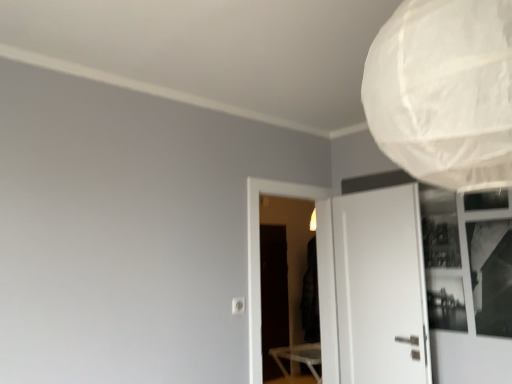
Question: From the image's perspective, would you say black matte screen door at center, the 2th screen door when ordered from front to back, is positioned over white paper lampshade at upper right?

Choices:
 (A) no
 (B) yes

Answer: (A)

Question: Can you confirm if black matte screen door at center, the first screen door positioned from the back, is taller than white paper lampshade at upper right?

Choices:
 (A) yes
 (B) no

Answer: (A)

Question: Does black matte screen door at center, the 2th screen door when ordered from front to back, lie behind white paper lampshade at upper right?

Choices:
 (A) yes
 (B) no

Answer: (A)

Question: Would you say black matte screen door at center, the 2th screen door when ordered from front to back, contains white paper lampshade at upper right?

Choices:
 (A) no
 (B) yes

Answer: (A)

Question: Is black matte screen door at center, the first screen door positioned from the back, in contact with white paper lampshade at upper right?

Choices:
 (A) no
 (B) yes

Answer: (A)

Question: Considering the relative positions of black matte screen door at center, the first screen door positioned from the back, and white paper lampshade at upper right in the image provided, is black matte screen door at center, the first screen door positioned from the back, in front of white paper lampshade at upper right?

Choices:
 (A) no
 (B) yes

Answer: (A)

Question: Is transparent plastic screen door at center, acting as the 1th screen door starting from the front, taller than black matte screen door at center, the first screen door positioned from the back?

Choices:
 (A) no
 (B) yes

Answer: (A)

Question: Are transparent plastic screen door at center, which is counted as the second screen door, starting from the back, and black matte screen door at center, the first screen door positioned from the back, beside each other?

Choices:
 (A) no
 (B) yes

Answer: (B)

Question: Does transparent plastic screen door at center, which is counted as the second screen door, starting from the back, come in front of black matte screen door at center, the first screen door positioned from the back?

Choices:
 (A) yes
 (B) no

Answer: (A)

Question: Is transparent plastic screen door at center, acting as the 1th screen door starting from the front, further to the viewer compared to black matte screen door at center, the first screen door positioned from the back?

Choices:
 (A) no
 (B) yes

Answer: (A)

Question: Is transparent plastic screen door at center, which is counted as the second screen door, starting from the back, positioned beyond the bounds of black matte screen door at center, the 2th screen door when ordered from front to back?

Choices:
 (A) yes
 (B) no

Answer: (A)

Question: Is transparent plastic screen door at center, acting as the 1th screen door starting from the front, looking in the opposite direction of black matte screen door at center, the 2th screen door when ordered from front to back?

Choices:
 (A) no
 (B) yes

Answer: (A)

Question: Is white matte door at right positioned in front of black glass window at upper right?

Choices:
 (A) yes
 (B) no

Answer: (B)